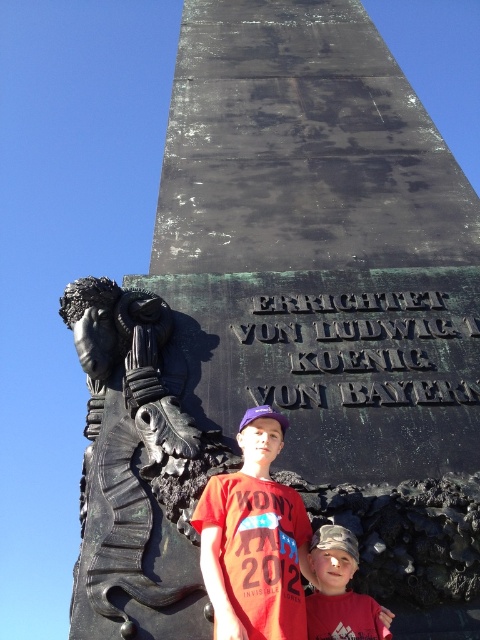
This screenshot has width=480, height=640. Find the location of `red matte t-shirt at center`. red matte t-shirt at center is located at coordinates [x=254, y=540].

Which of these two, red matte t-shirt at center or matte red shirt at center, stands shorter?

red matte t-shirt at center

Which is in front, point (299, 634) or point (326, 554)?

Point (299, 634) is in front.

I want to click on red matte t-shirt at center, so click(254, 540).